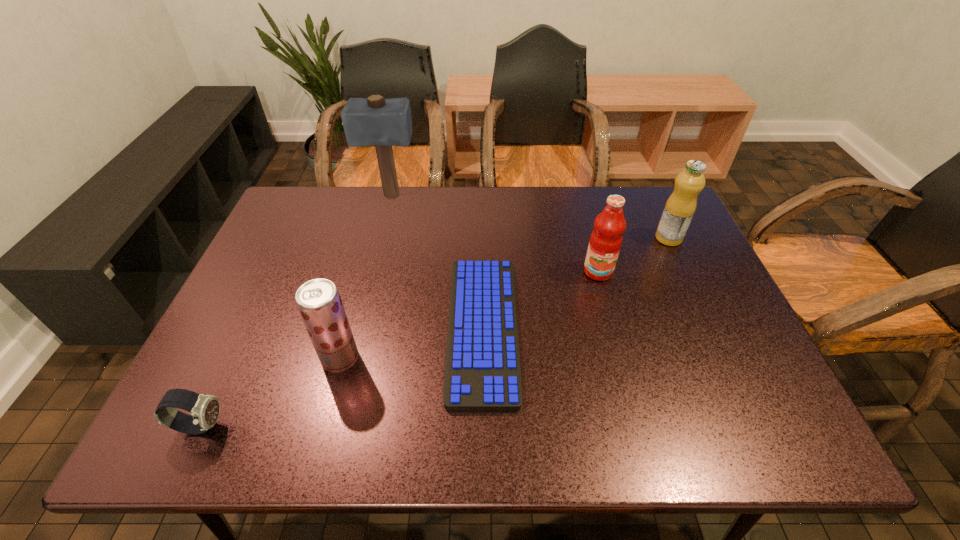
The height and width of the screenshot is (540, 960). What are the coordinates of `vacant space at the right edge of the desktop` in the screenshot? It's located at (663, 258).

Image resolution: width=960 pixels, height=540 pixels. Identify the location of vacant region at the far left corner of the desktop. (311, 186).

This screenshot has height=540, width=960. Find the location of `vacant space at the near left corner`. vacant space at the near left corner is located at coordinates (187, 449).

In the image, there is a desktop. Find the location of `vacant space at the far right corner`. vacant space at the far right corner is located at coordinates (658, 219).

I want to click on vacant space that is in between the nearest fruit juice and the second shortest object, so click(271, 392).

Find the location of a particular element. free spot between the fifth tallest object and the nearest fruit juice is located at coordinates (271, 392).

At what (x,y) coordinates should I click in order to perform the action: click on empty location between the farthest fruit juice and the third object from right to left. Please return your answer as a coordinate pair (x, y). The width and height of the screenshot is (960, 540). Looking at the image, I should click on (576, 283).

Find the location of a particular element. The height and width of the screenshot is (540, 960). empty location between the farthest fruit juice and the second fruit juice from left to right is located at coordinates (634, 255).

Find the location of a particular element. free space between the fourth object from left to right and the mallet is located at coordinates click(x=437, y=262).

Identify the location of vacant point located between the mallet and the watch. (296, 311).